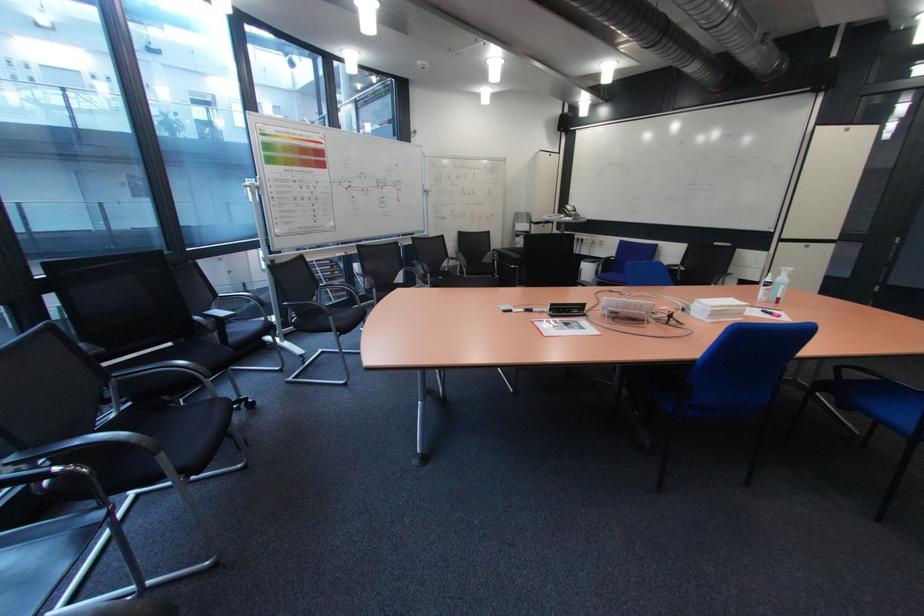
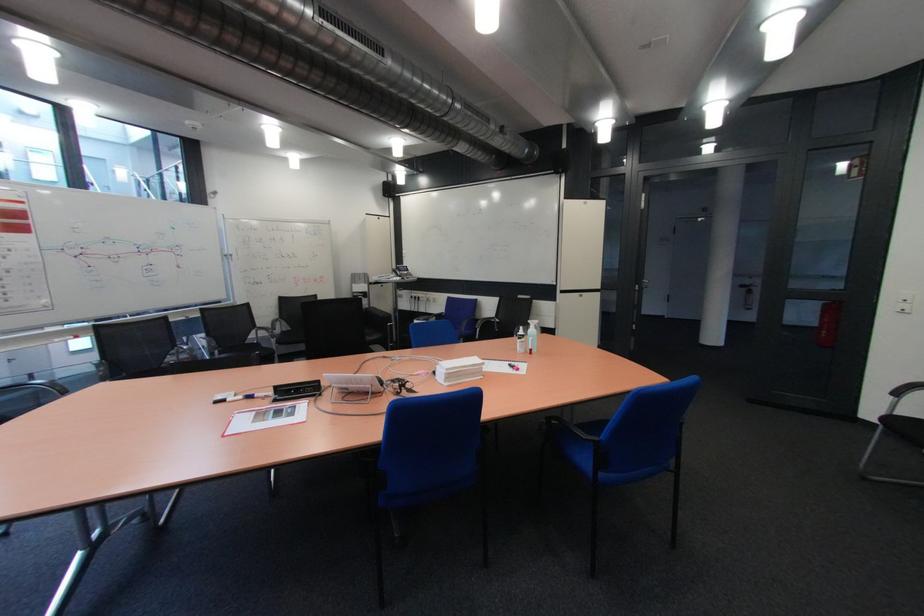
Question: What movement of the cameraman would produce the second image?

Choices:
 (A) Left
 (B) Right
 (C) Forward
 (D) Backward

Answer: (B)